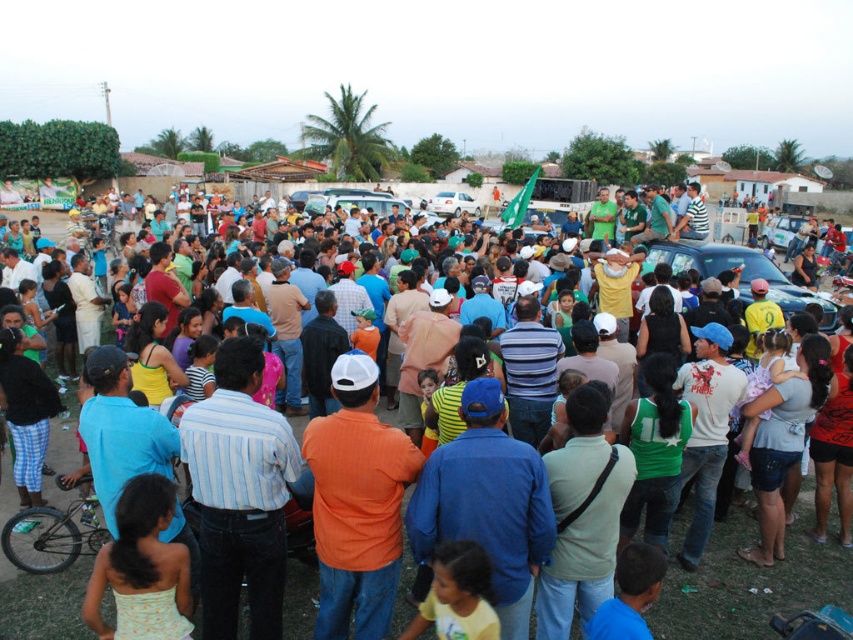
You are a photographer at the event and want to capture both the matte blue shirt at center and the metallic blue car at center in your photo. Which object will appear smaller in the final image?

The matte blue shirt at center will appear smaller in the final image because it has a lesser height compared to the metallic blue car at center.

You are a photographer trying to capture a photo of the metallic blue car at center without including the matte blue shirt at center in the frame. Based on their positions, is this possible?

The matte blue shirt at center is positioned on the left side of the metallic blue car at center, so if you move to the right side of the car and aim your camera away from the shirt, you can capture the car without the shirt in the frame.